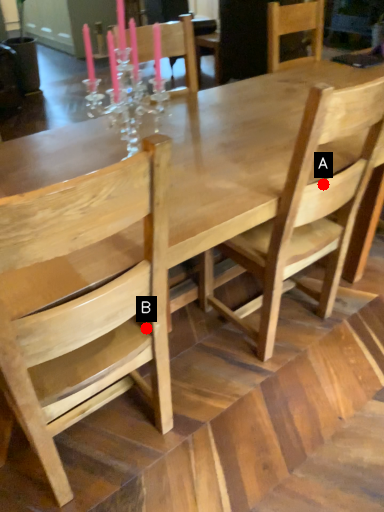
Question: Two points are circled on the image, labeled by A and B beside each circle. Which point is closer to the camera?

Choices:
 (A) A is closer
 (B) B is closer

Answer: (B)